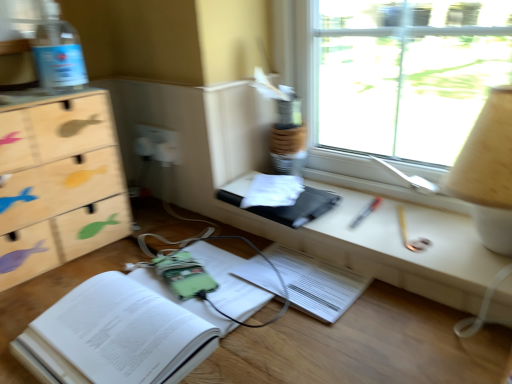
You are a GUI agent. You are given a task and a screenshot of the screen. Output one action in this format:
    pyautogui.click(x=<x>, y=<y>)
    Task: Click on the empty space that is in between black matte book at center, positioned as the 1th paperback book in top-to-bottom order, and beige fabric lampshade at upper right
    The width and height of the screenshot is (512, 384).
    Given the screenshot: What is the action you would take?
    pyautogui.click(x=379, y=216)